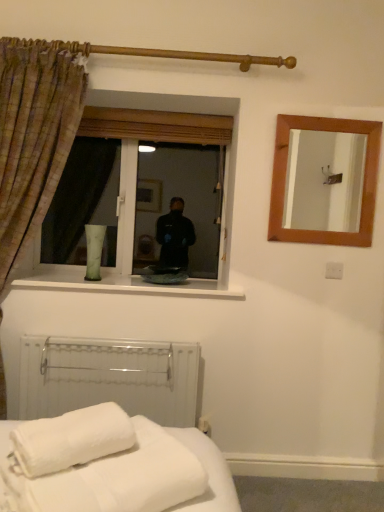
Question: Is plaid fabric curtain at left bigger than transparent glass window at center?

Choices:
 (A) yes
 (B) no

Answer: (A)

Question: Can we say plaid fabric curtain at left lies outside transparent glass window at center?

Choices:
 (A) no
 (B) yes

Answer: (B)

Question: From a real-world perspective, is plaid fabric curtain at left over transparent glass window at center?

Choices:
 (A) yes
 (B) no

Answer: (B)

Question: From a real-world perspective, is plaid fabric curtain at left below transparent glass window at center?

Choices:
 (A) yes
 (B) no

Answer: (A)

Question: Could you tell me if plaid fabric curtain at left is facing transparent glass window at center?

Choices:
 (A) yes
 (B) no

Answer: (B)

Question: From the image's perspective, relative to white plastic radiator at lower left, is plaid fabric curtain at left above or below?

Choices:
 (A) above
 (B) below

Answer: (A)

Question: Is plaid fabric curtain at left situated inside white plastic radiator at lower left or outside?

Choices:
 (A) outside
 (B) inside

Answer: (A)

Question: Is plaid fabric curtain at left wider or thinner than white plastic radiator at lower left?

Choices:
 (A) wide
 (B) thin

Answer: (A)

Question: From a real-world perspective, is plaid fabric curtain at left above or below white plastic radiator at lower left?

Choices:
 (A) above
 (B) below

Answer: (A)

Question: From a real-world perspective, is white soft towel at lower left physically located above or below wooden mirror at upper right?

Choices:
 (A) above
 (B) below

Answer: (B)

Question: Considering the relative positions of white soft towel at lower left and wooden mirror at upper right in the image provided, is white soft towel at lower left to the left or to the right of wooden mirror at upper right?

Choices:
 (A) right
 (B) left

Answer: (B)

Question: Looking at their shapes, would you say white soft towel at lower left is wider or thinner than wooden mirror at upper right?

Choices:
 (A) thin
 (B) wide

Answer: (B)

Question: Considering the positions of white soft towel at lower left and wooden mirror at upper right in the image, is white soft towel at lower left taller or shorter than wooden mirror at upper right?

Choices:
 (A) short
 (B) tall

Answer: (A)

Question: From a real-world perspective, is wooden mirror at upper right positioned above or below white soft towel at lower left?

Choices:
 (A) below
 (B) above

Answer: (B)

Question: In terms of size, does wooden mirror at upper right appear bigger or smaller than white soft towel at lower left?

Choices:
 (A) big
 (B) small

Answer: (B)